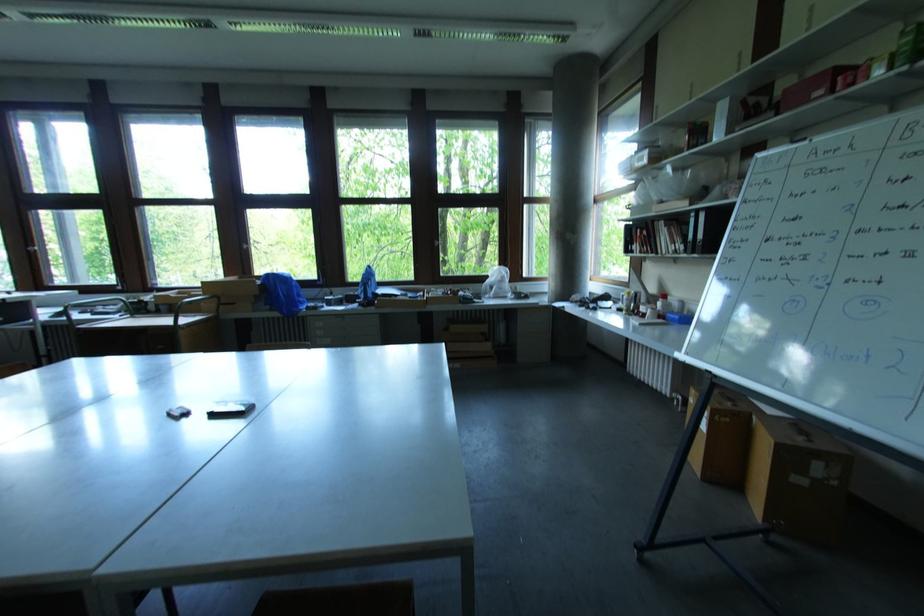
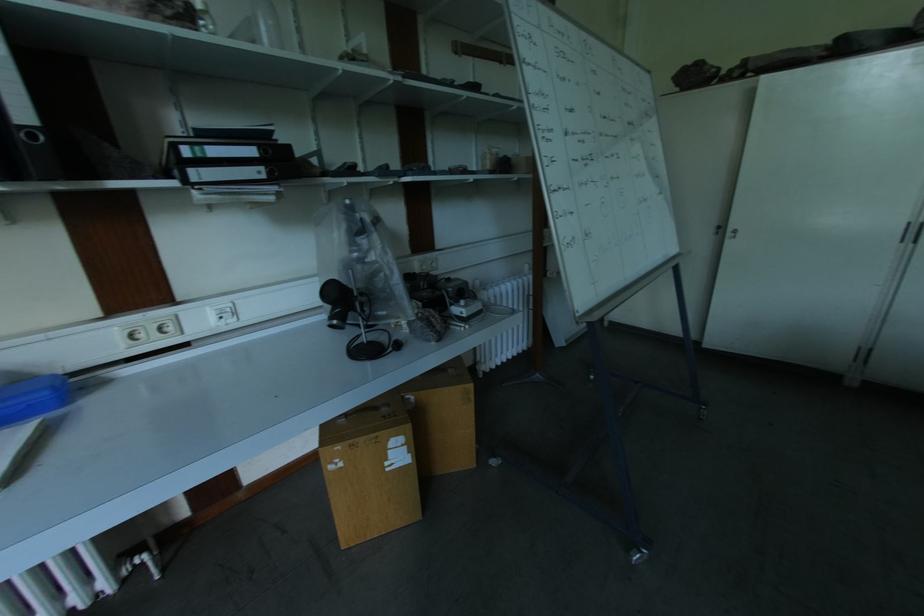
In the second image, find the point that corresponds to (x=679, y=318) in the first image.

(46, 395)